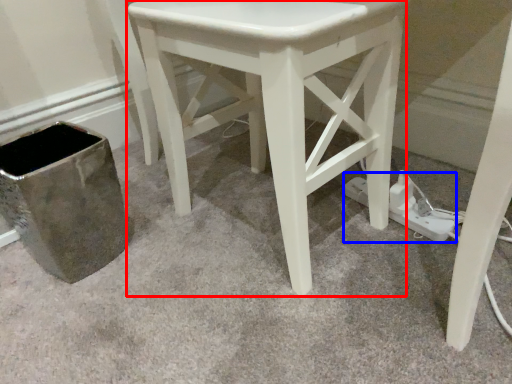
Question: Among these objects, which one is nearest to the camera, stool (highlighted by a red box) or plug (highlighted by a blue box)?

Choices:
 (A) stool
 (B) plug

Answer: (A)